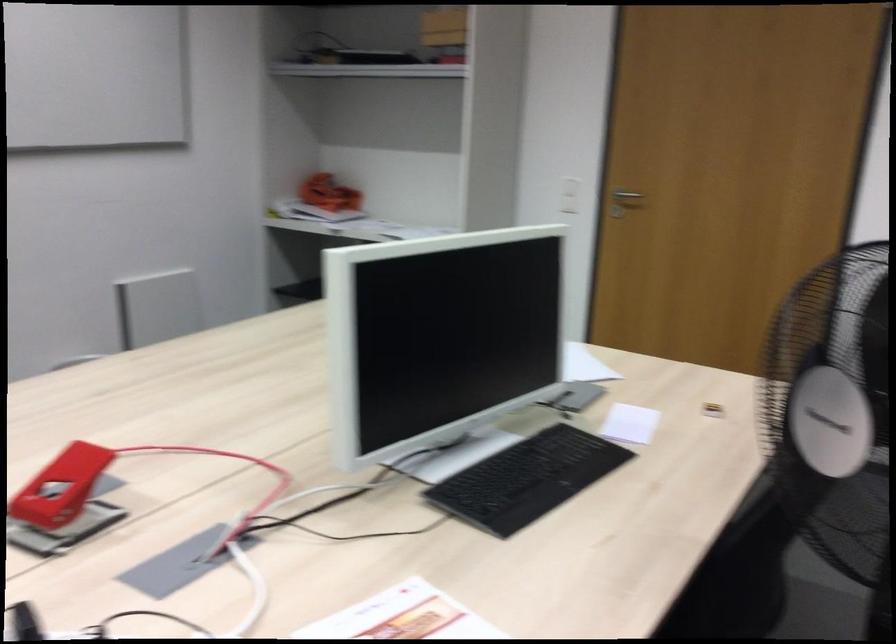
What do you see at coordinates (444, 26) in the screenshot? The width and height of the screenshot is (896, 644). I see `the small yellow box` at bounding box center [444, 26].